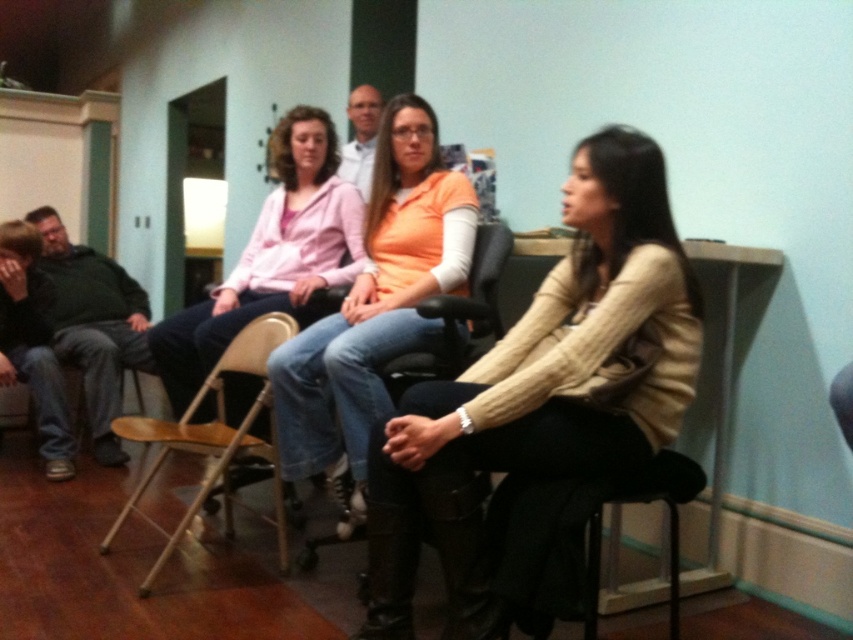
Does point (497, 394) come in front of point (326, 154)?

That is True.

Who is positioned more to the left, knit beige sweater at center or matte pink hoodie at center?

matte pink hoodie at center

The image size is (853, 640). What do you see at coordinates (543, 388) in the screenshot?
I see `knit beige sweater at center` at bounding box center [543, 388].

The width and height of the screenshot is (853, 640). In order to click on knit beige sweater at center in this screenshot , I will do `click(543, 388)`.

Who is higher up, knit beige sweater at center or metallic gold chair at center?

knit beige sweater at center is above.

Which is behind, point (643, 387) or point (173, 426)?

Point (173, 426)

Image resolution: width=853 pixels, height=640 pixels. What are the coordinates of `knit beige sweater at center` in the screenshot? It's located at (543, 388).

Describe the element at coordinates (375, 308) in the screenshot. I see `matte orange sweater at center` at that location.

Is the position of matte orange sweater at center more distant than that of matte pink hoodie at center?

That is False.

Is point (338, 481) closer to camera compared to point (189, 317)?

Yes, point (338, 481) is closer to viewer.

I want to click on matte orange sweater at center, so click(375, 308).